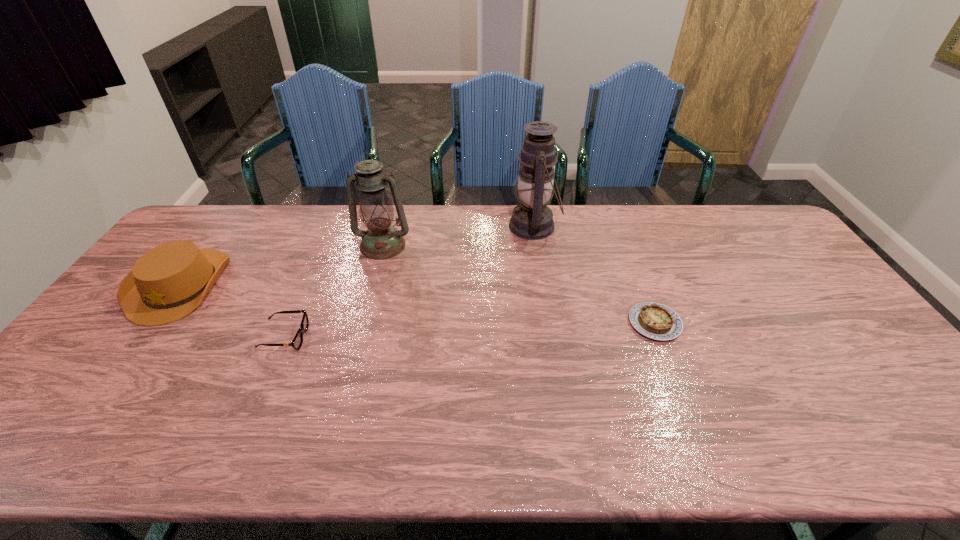
Find the location of a particular element. This screenshot has height=540, width=960. the right oil lamp is located at coordinates (532, 219).

Where is `the fourth shortest object`? This screenshot has width=960, height=540. the fourth shortest object is located at coordinates (381, 241).

You are a GUI agent. You are given a task and a screenshot of the screen. Output one action in this format:
    pyautogui.click(x=<x>, y=<y>)
    Task: Click on the left oil lamp
    The image size is (960, 540).
    Given the screenshot: What is the action you would take?
    pyautogui.click(x=381, y=241)

Locate an element on the screen. the third shortest object is located at coordinates click(x=168, y=282).

What are the coordinates of `cowboy hat` in the screenshot? It's located at 168,282.

Identify the location of sunglasses. The height and width of the screenshot is (540, 960). (297, 342).

Where is `the second object from left to right`? the second object from left to right is located at coordinates (297, 342).

Where is `the rightmost object`? This screenshot has height=540, width=960. the rightmost object is located at coordinates (653, 320).

This screenshot has height=540, width=960. Identify the location of the shortest object. (653, 320).

The width and height of the screenshot is (960, 540). What are the coordinates of `vacant area located on the front of the fourth object from left to right` in the screenshot? It's located at (543, 287).